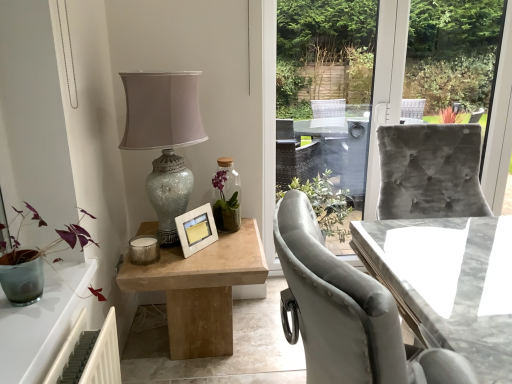
The width and height of the screenshot is (512, 384). In order to click on vacant area on top of natural wood table at center, positioned as the 2th table in right-to-left order (from a real-world perspective) in this screenshot , I will do `click(188, 252)`.